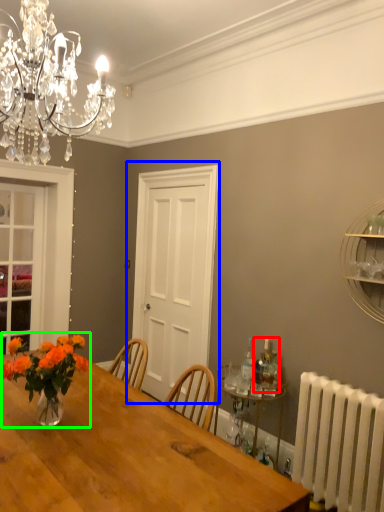
Question: Which object is the farthest from bottle (highlighted by a red box)? Choose among these: door (highlighted by a blue box) or floral arrangement (highlighted by a green box).

Choices:
 (A) door
 (B) floral arrangement

Answer: (A)